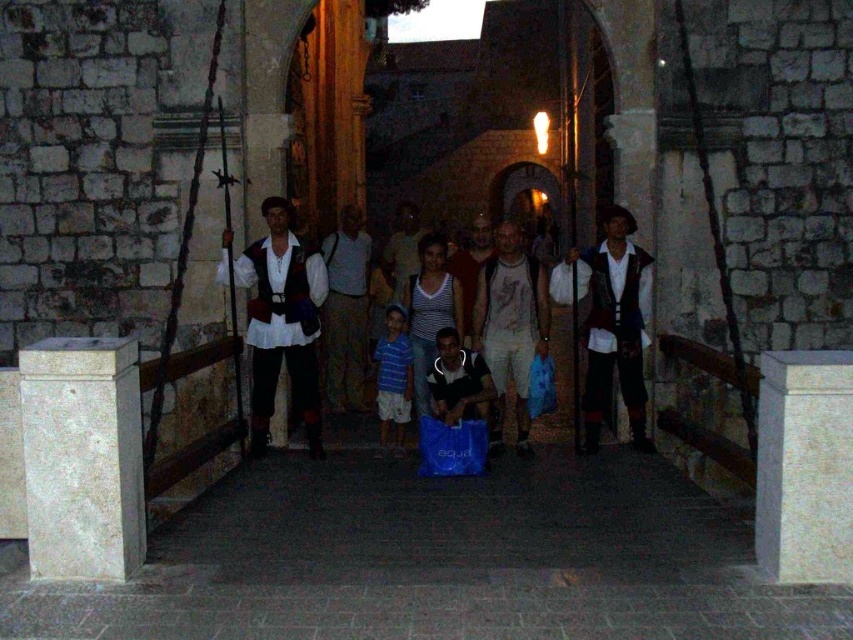
Does striped cotton shirt at center come behind blue plastic bag at center?

Yes, it is behind blue plastic bag at center.

Which is more to the right, striped cotton shirt at center or blue plastic bag at center?

From the viewer's perspective, blue plastic bag at center appears more on the right side.

Where is `striped cotton shirt at center`? The height and width of the screenshot is (640, 853). striped cotton shirt at center is located at coordinates (393, 378).

The height and width of the screenshot is (640, 853). I want to click on striped cotton shirt at center, so click(x=393, y=378).

Can you confirm if white cotton t-shirt at center is positioned below matte red vest at center?

Yes.

Can you confirm if white cotton t-shirt at center is smaller than matte red vest at center?

Yes.

Locate an element on the screen. This screenshot has height=640, width=853. white cotton t-shirt at center is located at coordinates (509, 324).

At what (x,y) coordinates should I click in order to perform the action: click on white cotton t-shirt at center. Please return your answer as a coordinate pair (x, y). This screenshot has height=640, width=853. Looking at the image, I should click on (509, 324).

Is striped cotton shirt at center closer to camera compared to matte white shirt at center?

Yes, striped cotton shirt at center is closer to the viewer.

Is striped cotton shirt at center to the left of matte white shirt at center from the viewer's perspective?

In fact, striped cotton shirt at center is to the right of matte white shirt at center.

Who is more forward, (381, 432) or (415, 230)?

Point (381, 432) is more forward.

Identify the location of striped cotton shirt at center. (393, 378).